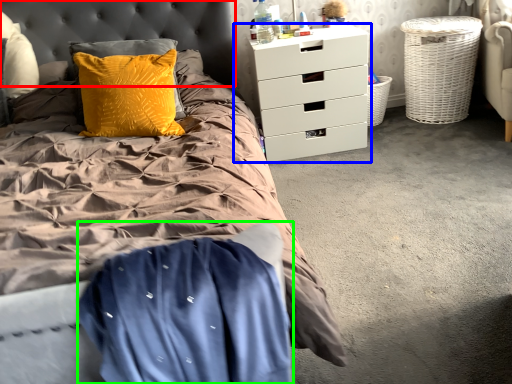
Question: Considering the real-world distances, which object is farthest from headboard (highlighted by a red box)? chest of drawers (highlighted by a blue box) or blanket (highlighted by a green box)?

Choices:
 (A) chest of drawers
 (B) blanket

Answer: (B)